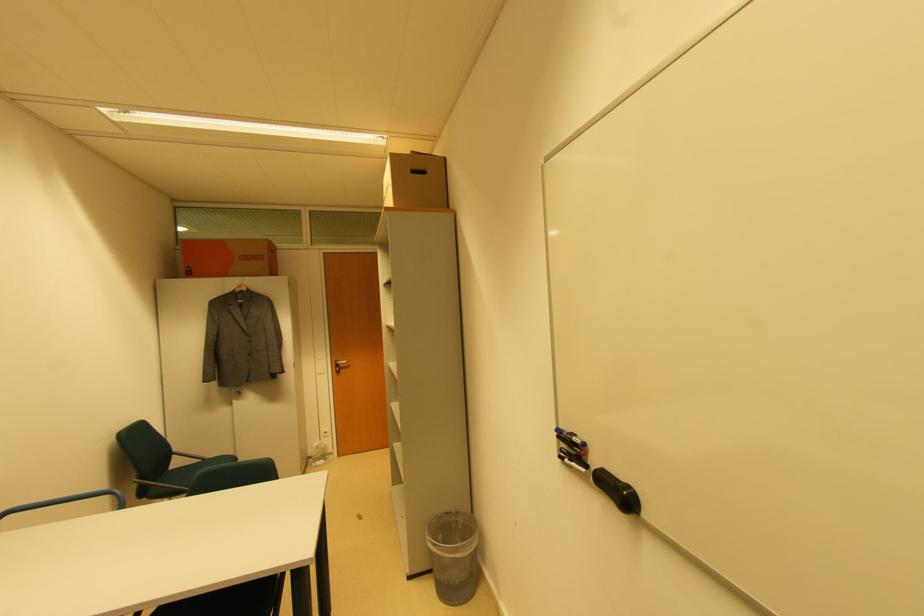
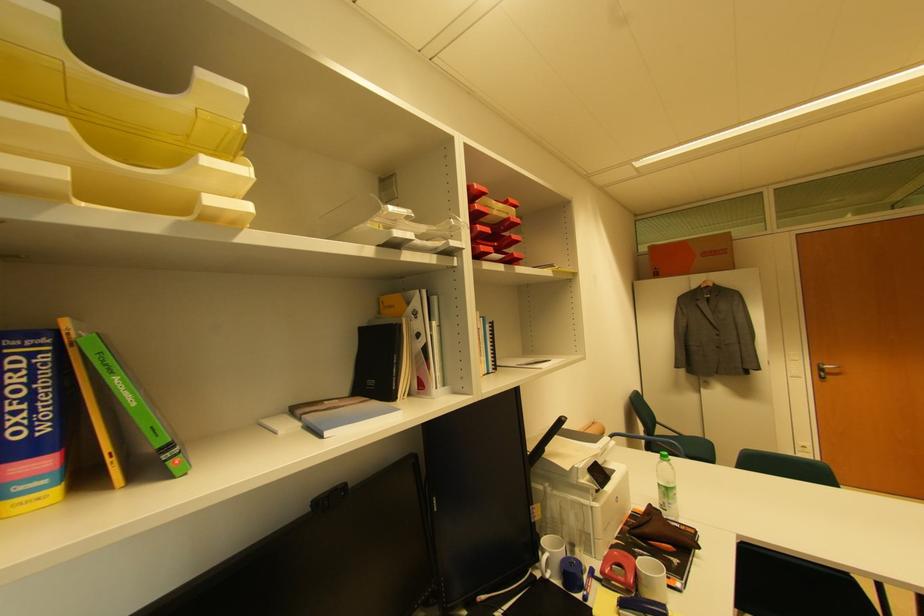
Question: The images are taken continuously from a first-person perspective. In which direction is your viewpoint rotating?

Choices:
 (A) Left
 (B) Right
 (C) Up
 (D) Down

Answer: (A)